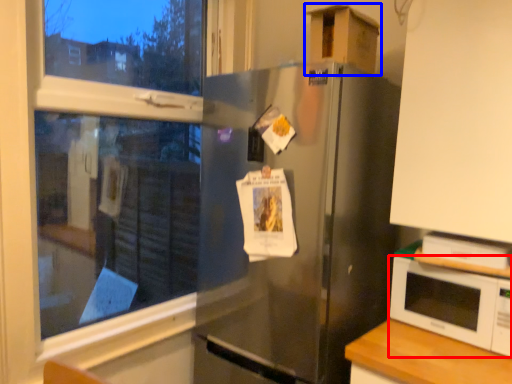
Question: Which of the following is the farthest to the observer, microwave oven (highlighted by a red box) or cardboard box (highlighted by a blue box)?

Choices:
 (A) microwave oven
 (B) cardboard box

Answer: (B)